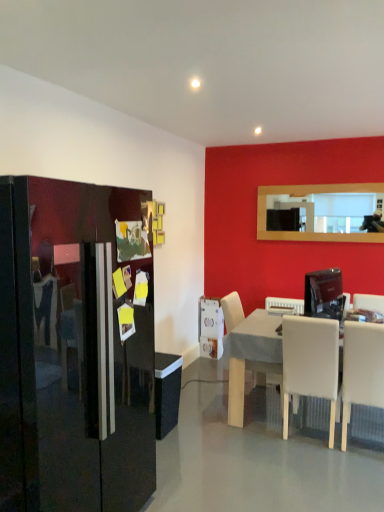
Measure the distance between white leather chair at center, which is counted as the 3th chair, starting from the right, and camera.

A distance of 11.18 feet exists between white leather chair at center, which is counted as the 3th chair, starting from the right, and camera.

I want to click on white leather chair at center, which is counted as the 3th chair, starting from the right, so click(x=232, y=310).

Where is `white plastic toaster at center, which is the second appliance in left-to-right order`? Image resolution: width=384 pixels, height=512 pixels. white plastic toaster at center, which is the second appliance in left-to-right order is located at coordinates point(285,303).

What is the approximate height of white matte chair at lower right, the 2th chair viewed from the left?

white matte chair at lower right, the 2th chair viewed from the left, is 38.22 inches tall.

Where is `white leather chair at center, which is counted as the 3th chair, starting from the right`? white leather chair at center, which is counted as the 3th chair, starting from the right is located at coordinates (232, 310).

Considering the relative sizes of white glossy toaster at lower center, which is the first appliance from bottom to top, and white leather chair at center, which is the 1th chair in left-to-right order, in the image provided, is white glossy toaster at lower center, which is the first appliance from bottom to top, bigger than white leather chair at center, which is the 1th chair in left-to-right order,?

No.

Which point is more distant from viewer, (204, 306) or (236, 319)?

Point (204, 306)

Would you say white leather chair at center, which is counted as the 3th chair, starting from the right, is part of white glossy toaster at lower center, the 3th appliance positioned from the top,'s contents?

Actually, white leather chair at center, which is counted as the 3th chair, starting from the right, is outside white glossy toaster at lower center, the 3th appliance positioned from the top.

Is white glossy toaster at lower center, which is the first appliance from bottom to top, placed right next to white leather chair at center, which is counted as the 3th chair, starting from the right?

No, white glossy toaster at lower center, which is the first appliance from bottom to top, is not making contact with white leather chair at center, which is counted as the 3th chair, starting from the right.

Considering the relative sizes of satin black monitor at right, which appears as the 1th appliance when viewed from the front, and white plastic toaster at center, positioned as the 2th appliance in bottom-to-top order, in the image provided, is satin black monitor at right, which appears as the 1th appliance when viewed from the front, bigger than white plastic toaster at center, positioned as the 2th appliance in bottom-to-top order,?

Correct, satin black monitor at right, which appears as the 1th appliance when viewed from the front, is larger in size than white plastic toaster at center, positioned as the 2th appliance in bottom-to-top order.

Can you confirm if satin black monitor at right, the 1th appliance in the top-to-bottom sequence, is positioned to the right of white plastic toaster at center, the 2th appliance when ordered from right to left?

Yes, satin black monitor at right, the 1th appliance in the top-to-bottom sequence, is to the right of white plastic toaster at center, the 2th appliance when ordered from right to left.

From the picture: Is satin black monitor at right, which is the 3th appliance from back to front, next to white plastic toaster at center, which is the second appliance in left-to-right order, and touching it?

No.

Does white matte chair at lower right, which appears as the second chair when viewed from the right, lie in front of glossy black refrigerator at left?

No, it is behind glossy black refrigerator at left.

Is white matte chair at lower right, the 2th chair viewed from the left, taller than glossy black refrigerator at left?

No, white matte chair at lower right, the 2th chair viewed from the left, is not taller than glossy black refrigerator at left.

Does point (298, 388) come in front of point (226, 327)?

Yes.

In the scene shown: Choose the correct answer: Is white matte chair at lower right, the 2th chair viewed from the left, inside white leather chair at center, which is counted as the 3th chair, starting from the right, or outside it?

white matte chair at lower right, the 2th chair viewed from the left, cannot be found inside white leather chair at center, which is counted as the 3th chair, starting from the right.

Could you measure the distance between white matte chair at lower right, the 2th chair viewed from the left, and white leather chair at center, which is the 1th chair in left-to-right order?

white matte chair at lower right, the 2th chair viewed from the left, and white leather chair at center, which is the 1th chair in left-to-right order, are 28.10 inches apart.

Is white matte chair at lower right, the 2th chair viewed from the left, wider or thinner than white leather chair at center, which is counted as the 3th chair, starting from the right?

Considering their sizes, white matte chair at lower right, the 2th chair viewed from the left, looks slimmer than white leather chair at center, which is counted as the 3th chair, starting from the right.

Would you say white leather chair at center, which is counted as the 3th chair, starting from the right, is part of white plastic toaster at center, marked as the 2th appliance in a back-to-front arrangement,'s contents?

No.

Is white plastic toaster at center, which is the second appliance in left-to-right order, facing towards white leather chair at center, which is the 1th chair in left-to-right order?

No, white plastic toaster at center, which is the second appliance in left-to-right order, is not aimed at white leather chair at center, which is the 1th chair in left-to-right order.

Which is more to the left, white plastic toaster at center, marked as the 2th appliance in a back-to-front arrangement, or white leather chair at center, which is counted as the 3th chair, starting from the right?

Positioned to the left is white leather chair at center, which is counted as the 3th chair, starting from the right.

In the scene shown: Is white leather chair at lower right, arranged as the 1th chair when viewed from the right, wider or thinner than white leather chair at center, which is counted as the 3th chair, starting from the right?

In the image, white leather chair at lower right, arranged as the 1th chair when viewed from the right, appears to be more narrow than white leather chair at center, which is counted as the 3th chair, starting from the right.

Considering the sizes of white leather chair at lower right, arranged as the 1th chair when viewed from the right, and white leather chair at center, which is counted as the 3th chair, starting from the right, in the image, is white leather chair at lower right, arranged as the 1th chair when viewed from the right, taller or shorter than white leather chair at center, which is counted as the 3th chair, starting from the right,?

Considering their sizes, white leather chair at lower right, arranged as the 1th chair when viewed from the right, has less height than white leather chair at center, which is counted as the 3th chair, starting from the right.

From the image's perspective, relative to white leather chair at center, which is counted as the 3th chair, starting from the right, is white leather chair at lower right, arranged as the 1th chair when viewed from the right, above or below?

white leather chair at lower right, arranged as the 1th chair when viewed from the right, is situated lower than white leather chair at center, which is counted as the 3th chair, starting from the right, in the image.

Is white leather chair at lower right, arranged as the 1th chair when viewed from the right, far away from white leather chair at center, which is the 1th chair in left-to-right order?

Indeed, white leather chair at lower right, arranged as the 1th chair when viewed from the right, is not near white leather chair at center, which is the 1th chair in left-to-right order.

Is white plastic toaster at center, positioned as the 2th appliance in bottom-to-top order, oriented towards white leather chair at lower right, which is the 3th chair from left to right?

No, white plastic toaster at center, positioned as the 2th appliance in bottom-to-top order, is not turned towards white leather chair at lower right, which is the 3th chair from left to right.

Is white plastic toaster at center, positioned as the 2th appliance in bottom-to-top order, further to camera compared to white leather chair at lower right, arranged as the 1th chair when viewed from the right?

Yes, white plastic toaster at center, positioned as the 2th appliance in bottom-to-top order, is further from the viewer.

Find the location of `appliance that is the 2nd one when counting leftward from the white leather chair at lower right, which is the 3th chair from left to right`. appliance that is the 2nd one when counting leftward from the white leather chair at lower right, which is the 3th chair from left to right is located at coordinates (285, 303).

Considering the positions of point (299, 307) and point (365, 354), is point (299, 307) closer or farther from the camera than point (365, 354)?

Clearly, point (299, 307) is more distant from the camera than point (365, 354).

This screenshot has height=512, width=384. In the image, there is a white leather chair at center, which is counted as the 3th chair, starting from the right. Find the location of `appliance below it (from the image's perspective)`. appliance below it (from the image's perspective) is located at coordinates (211, 328).

There is a satin black monitor at right, the 1th appliance in the top-to-bottom sequence. At what (x,y) coordinates should I click in order to perform the action: click on the 1st appliance below it (from a real-world perspective). Please return your answer as a coordinate pair (x, y). The height and width of the screenshot is (512, 384). Looking at the image, I should click on (285, 303).

Considering their positions, is satin black monitor at right, marked as the first appliance in a right-to-left arrangement, positioned closer to white matte chair at lower right, which appears as the second chair when viewed from the right, than white leather chair at center, which is counted as the 3th chair, starting from the right?

The object closer to white matte chair at lower right, which appears as the second chair when viewed from the right, is white leather chair at center, which is counted as the 3th chair, starting from the right.

Considering their positions, is satin black monitor at right, the 1th appliance in the top-to-bottom sequence, positioned closer to white leather chair at center, which is the 1th chair in left-to-right order, than white matte table at center?

The object closer to white leather chair at center, which is the 1th chair in left-to-right order, is white matte table at center.

Looking at the image, which one is located further to satin black monitor at right, the 1th appliance in the top-to-bottom sequence, white matte chair at lower right, the 2th chair viewed from the left, or glossy black refrigerator at left?

glossy black refrigerator at left.

Which object lies further to the anchor point white plastic toaster at center, positioned as the 2th appliance in bottom-to-top order, satin black monitor at right, the 1th appliance in the top-to-bottom sequence, or white glossy toaster at lower center, the third appliance when ordered from right to left?

The object further to white plastic toaster at center, positioned as the 2th appliance in bottom-to-top order, is white glossy toaster at lower center, the third appliance when ordered from right to left.

From the image, which object appears to be nearer to white glossy toaster at lower center, which is the first appliance from bottom to top, glossy black refrigerator at left or white leather chair at lower right, which is the 3th chair from left to right?

white leather chair at lower right, which is the 3th chair from left to right.

When comparing their distances from glossy black refrigerator at left, does white glossy toaster at lower center, the third appliance when ordered from right to left, or white leather chair at lower right, arranged as the 1th chair when viewed from the right, seem further?

white glossy toaster at lower center, the third appliance when ordered from right to left, is further to glossy black refrigerator at left.

Considering their positions, is white leather chair at lower right, which is the 3th chair from left to right, positioned closer to white plastic toaster at center, the 2th appliance when ordered from right to left, than white matte chair at lower right, the 2th chair viewed from the left?

white matte chair at lower right, the 2th chair viewed from the left, is positioned closer to the anchor white plastic toaster at center, the 2th appliance when ordered from right to left.

Looking at the image, which one is located further to white leather chair at center, which is counted as the 3th chair, starting from the right, white plastic toaster at center, positioned as the 2th appliance in bottom-to-top order, or satin black monitor at right, the third appliance viewed from the left?

The object further to white leather chair at center, which is counted as the 3th chair, starting from the right, is satin black monitor at right, the third appliance viewed from the left.

Where is `appliance between white leather chair at lower right, arranged as the 1th chair when viewed from the right, and white plastic toaster at center, which is the second appliance in left-to-right order, from front to back`? The image size is (384, 512). appliance between white leather chair at lower right, arranged as the 1th chair when viewed from the right, and white plastic toaster at center, which is the second appliance in left-to-right order, from front to back is located at coordinates (324, 294).

Where is `table positioned between white leather chair at lower right, arranged as the 1th chair when viewed from the right, and white leather chair at center, which is the 1th chair in left-to-right order, from near to far`? The height and width of the screenshot is (512, 384). table positioned between white leather chair at lower right, arranged as the 1th chair when viewed from the right, and white leather chair at center, which is the 1th chair in left-to-right order, from near to far is located at coordinates (250, 356).

This screenshot has width=384, height=512. Find the location of `table between glossy black refrigerator at left and white plastic toaster at center, which is the second appliance in left-to-right order, in the front-back direction`. table between glossy black refrigerator at left and white plastic toaster at center, which is the second appliance in left-to-right order, in the front-back direction is located at coordinates (250, 356).

Find the location of a particular element. The height and width of the screenshot is (512, 384). chair between satin black monitor at right, which is the 3th appliance from bottom to top, and white glossy toaster at lower center, which ranks as the first appliance in left-to-right order, from front to back is located at coordinates coord(232,310).